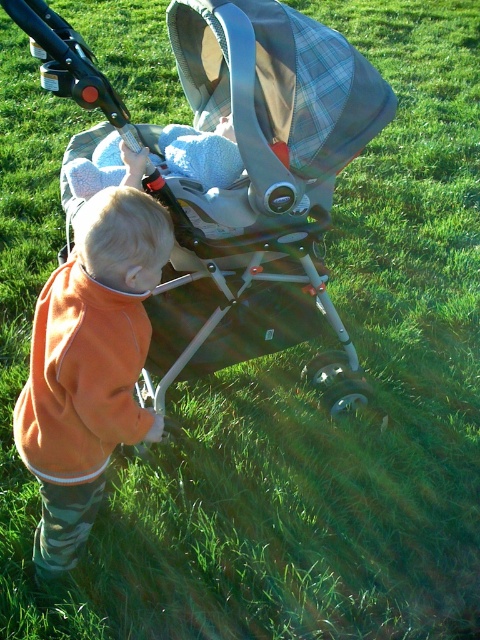
You are a parent trying to pack the silver metallic stroller at center and the soft blue blanket at center into a trunk that can only fit one item. Based on their sizes, which item should you choose to take?

The silver metallic stroller at center has a larger size compared to the soft blue blanket at center, so you should take the soft blue blanket at center since it is smaller and will fit in the trunk.

You are a parent trying to ensure your child stays warm during a chilly outdoor activity. You have an orange fleece jacket at center and a soft blue blanket at center. Based on their positions, which item is covering the other?

The orange fleece jacket at center is positioned under the soft blue blanket at center, so the soft blue blanket at center is covering the orange fleece jacket at center.

You are a photographer trying to capture the stroller in the center of the image. You notice a point marked at coordinates (240, 182). Based on the scene description, can you confirm if this point is located on the silver metallic stroller at center?

Yes, the point at coordinates (240, 182) is located on the silver metallic stroller at center according to the objects description.